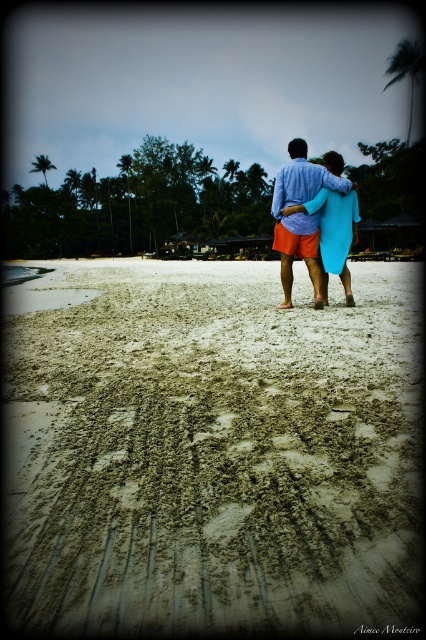
Which is below, brown sandy beach at center or matte blue surfboard at center?

brown sandy beach at center is lower down.

Identify the location of brown sandy beach at center. (215, 452).

Locate an element on the screen. This screenshot has height=640, width=426. brown sandy beach at center is located at coordinates tap(215, 452).